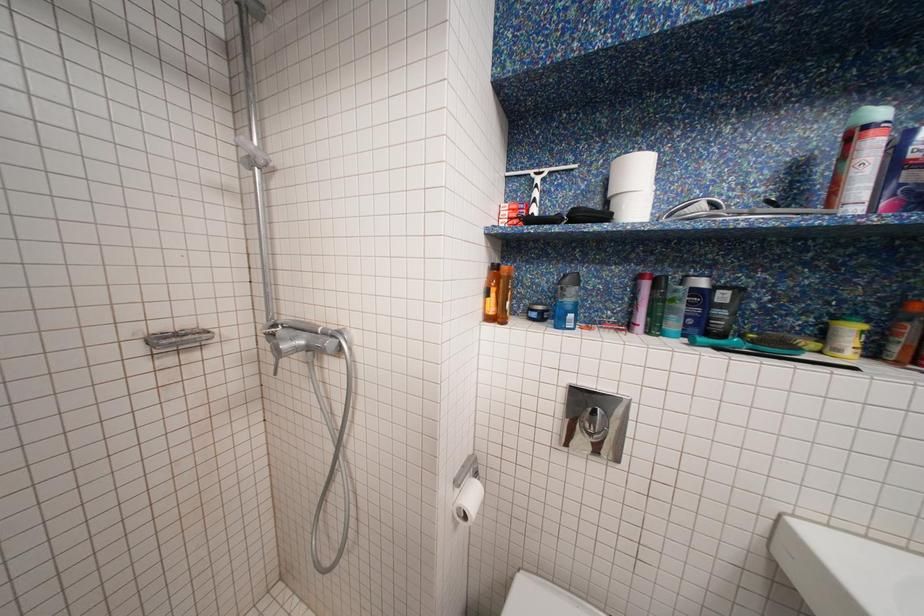
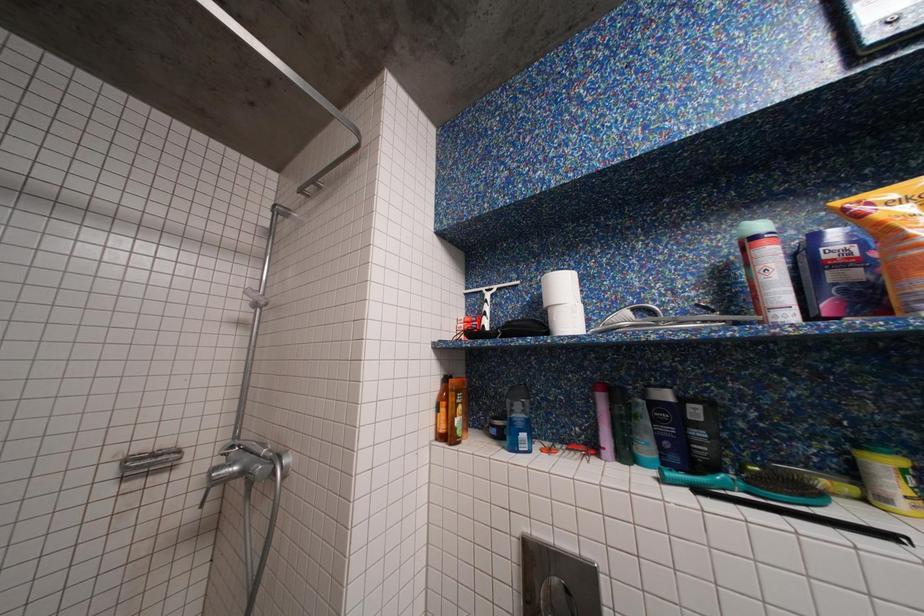
Question: In a continuous first-person perspective shot, in which direction is the camera moving?

Choices:
 (A) Left
 (B) Right
 (C) Forward
 (D) Backward

Answer: (B)